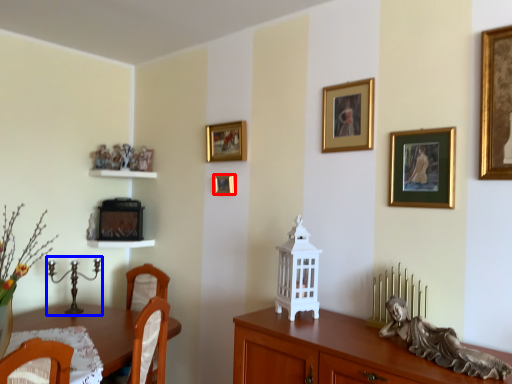
Question: Which of the following is the closest to the observer, picture frame (highlighted by a red box) or candle holder (highlighted by a blue box)?

Choices:
 (A) picture frame
 (B) candle holder

Answer: (B)